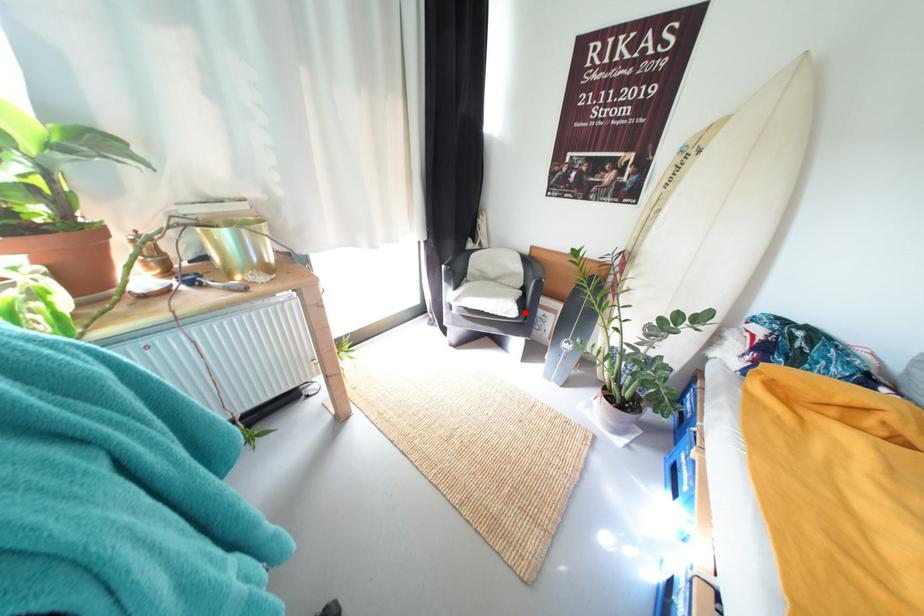
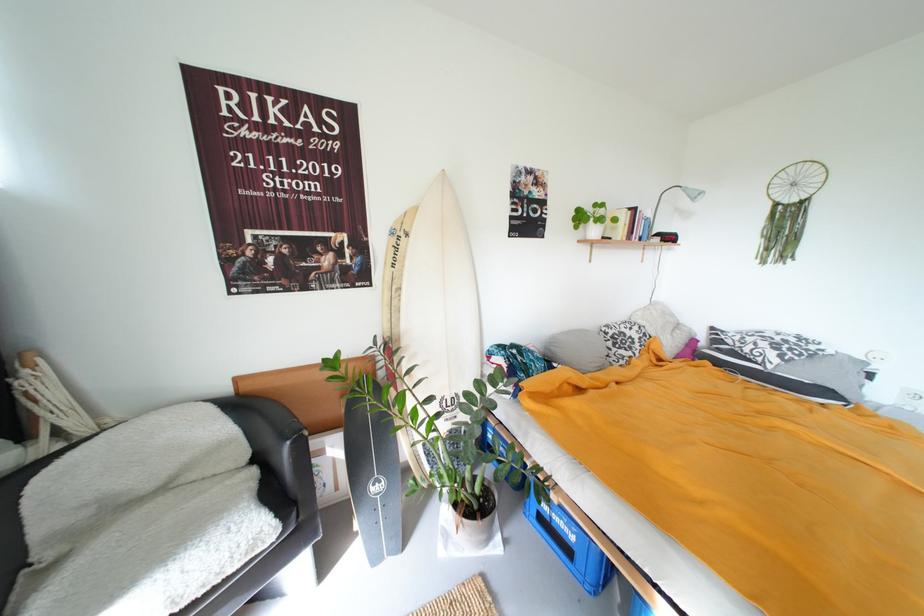
Find the pixel in the second image that matches the highlighted location in the first image.

(284, 524)